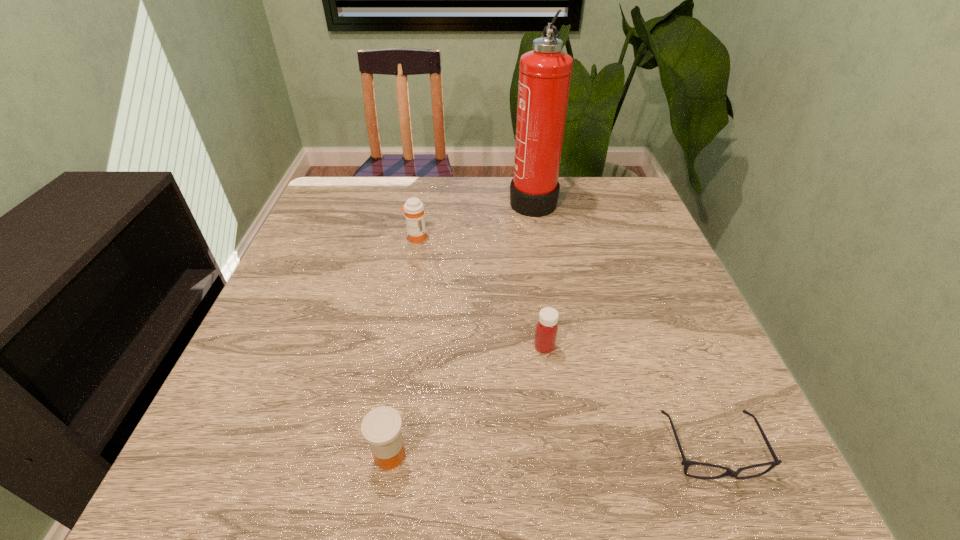
Where is `fire extinguisher`? The width and height of the screenshot is (960, 540). fire extinguisher is located at coordinates (545, 72).

Identify the location of the farthest object. This screenshot has height=540, width=960. (545, 72).

Locate an element on the screen. the fourth nearest object is located at coordinates (414, 209).

Where is `the rightmost medicine`? This screenshot has height=540, width=960. the rightmost medicine is located at coordinates (546, 329).

Where is `the third nearest object`? This screenshot has width=960, height=540. the third nearest object is located at coordinates (546, 329).

Identify the location of the nearest medicine. This screenshot has width=960, height=540. point(381,427).

Where is `the shortest object`? The width and height of the screenshot is (960, 540). the shortest object is located at coordinates (686, 463).

You are a GUI agent. You are given a task and a screenshot of the screen. Output one action in this format:
    pyautogui.click(x=<x>, y=<y>)
    Task: Click on the rightmost object
    
    Given the screenshot: What is the action you would take?
    pyautogui.click(x=686, y=463)

Find the location of `vacant space positioned 0.050m on the front-facing side of the fire extinguisher`. vacant space positioned 0.050m on the front-facing side of the fire extinguisher is located at coordinates (492, 199).

This screenshot has height=540, width=960. I want to click on free space located on the front-facing side of the fire extinguisher, so click(x=426, y=199).